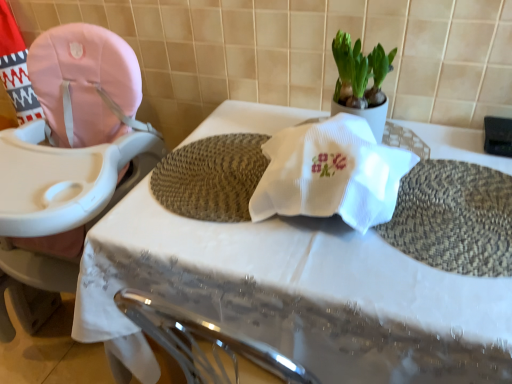
Question: Does point (351, 61) appear closer or farther from the camera than point (416, 130)?

Choices:
 (A) farther
 (B) closer

Answer: (B)

Question: Is green leafy plant at upper center wider or thinner than white woven placemat at center?

Choices:
 (A) thin
 (B) wide

Answer: (A)

Question: Considering the real-world distances, which object is farthest from the white woven placemat at center?

Choices:
 (A) green leafy plant at upper center
 (B) pink fabric baby carriage at left

Answer: (A)

Question: Which object is the closest to the pink fabric baby carriage at left?

Choices:
 (A) white woven placemat at center
 (B) green leafy plant at upper center

Answer: (A)